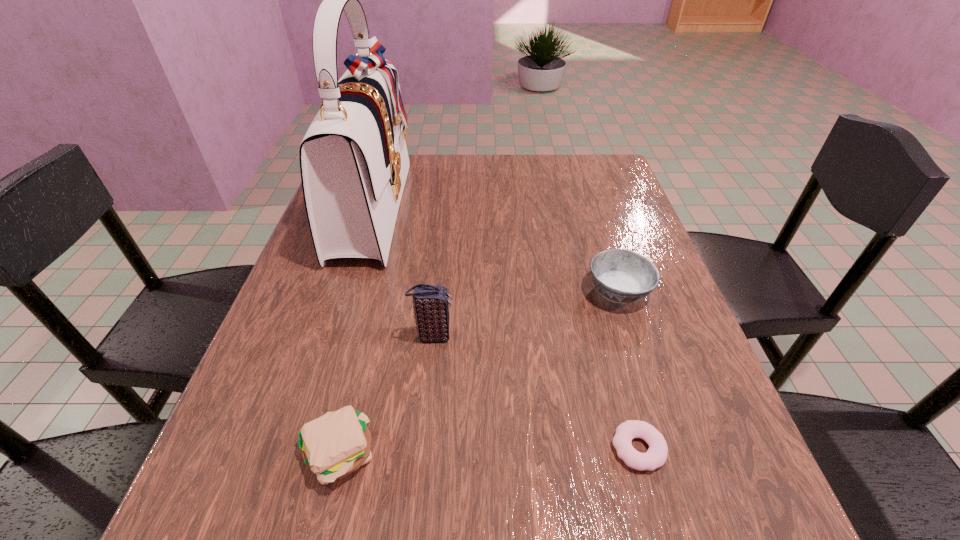
Identify the location of the tallest object. The height and width of the screenshot is (540, 960). (354, 162).

Where is `the third nearest object`? the third nearest object is located at coordinates (430, 303).

Where is `the third object from right to left`? Image resolution: width=960 pixels, height=540 pixels. the third object from right to left is located at coordinates tap(430, 303).

Where is `ashtray`? The width and height of the screenshot is (960, 540). ashtray is located at coordinates (622, 276).

Find the location of `patty`. patty is located at coordinates (333, 446).

Where is `doughnut`? doughnut is located at coordinates (656, 455).

You are a GUI agent. You are given a task and a screenshot of the screen. Output one action in this format:
    pyautogui.click(x=<x>, y=<y>)
    Task: Click on the free spot located on the front-facing side of the satchel
    
    Given the screenshot: What is the action you would take?
    pyautogui.click(x=449, y=207)

What are the coordinates of `vacant region located 0.310m with the zip open on the second tallest object` in the screenshot? It's located at (615, 336).

At what (x,y) coordinates should I click in order to perform the action: click on vacant region located 0.220m on the back of the ashtray. Please return your answer as a coordinate pair (x, y). Looking at the image, I should click on (593, 213).

Locate an element on the screen. vacant area situated 0.130m on the left of the patty is located at coordinates (215, 454).